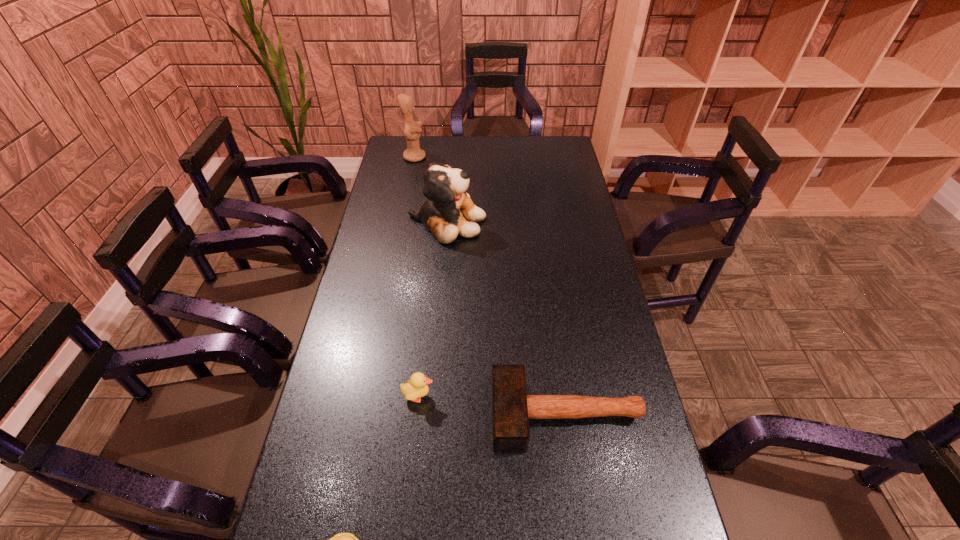
At what (x,y) coordinates should I click in order to perform the action: click on unoccupied area between the fourth shortest object and the mallet. Please return your answer as a coordinate pair (x, y). Looking at the image, I should click on (507, 318).

Where is `free space that is in between the puppy and the taller duckling`? free space that is in between the puppy and the taller duckling is located at coordinates pyautogui.click(x=433, y=309).

The image size is (960, 540). In order to click on free space between the figurine and the taller duckling in this screenshot , I will do `click(417, 276)`.

Locate an element on the screen. The image size is (960, 540). the closest object to the mallet is located at coordinates (417, 387).

Find the location of a particular element. This screenshot has width=960, height=540. object that can be found as the second closest to the farther duckling is located at coordinates (342, 539).